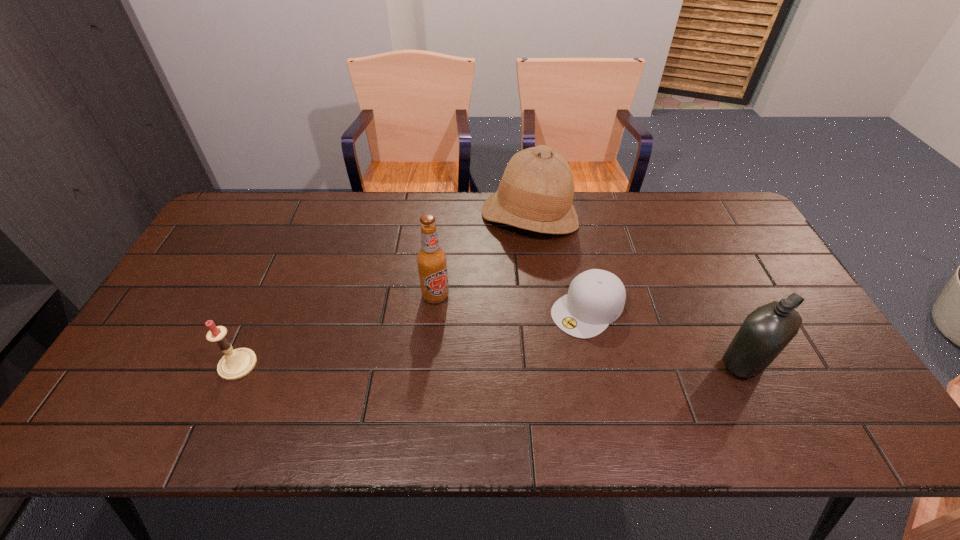
Image resolution: width=960 pixels, height=540 pixels. Find the location of `free spot between the second shortest object and the hat`. free spot between the second shortest object and the hat is located at coordinates (383, 291).

You are a GUI agent. You are given a task and a screenshot of the screen. Output one action in this format:
    pyautogui.click(x=<x>, y=<y>)
    Task: Click on the free space between the second object from left to right and the hat
    
    Given the screenshot: What is the action you would take?
    pyautogui.click(x=482, y=256)

Where is `empty space between the farthest object and the cap`? The height and width of the screenshot is (540, 960). empty space between the farthest object and the cap is located at coordinates (559, 262).

At what (x,y) coordinates should I click in order to perform the action: click on vacant area that lies between the shortest object and the bottle. Please return your answer as a coordinate pair (x, y). Looking at the image, I should click on (666, 335).

At what (x,y) coordinates should I click in order to perform the action: click on free space between the rightmost object and the shortest object. Please return your answer as a coordinate pair (x, y). The image size is (960, 540). Looking at the image, I should click on (666, 335).

Where is `free space between the third shortest object and the shortest object`? free space between the third shortest object and the shortest object is located at coordinates (666, 335).

Identify which object is the nearest to the cap. Please provide its 2D coordinates. Your answer should be formatted as a tuple, i.e. [(x, y)], where the tuple contains the x and y coordinates of a point satisfying the conditions above.

[(536, 192)]

Identify which object is the third nearest to the farthest object. Please provide its 2D coordinates. Your answer should be formatted as a tuple, i.e. [(x, y)], where the tuple contains the x and y coordinates of a point satisfying the conditions above.

[(766, 331)]

At what (x,y) coordinates should I click in order to perform the action: click on blank space that satisfies the following two spatial constraints: 1. on the front side of the cap; 2. on the left side of the fourth object from right to left. Please return your answer as a coordinate pair (x, y). Image resolution: width=960 pixels, height=540 pixels. Looking at the image, I should click on (434, 309).